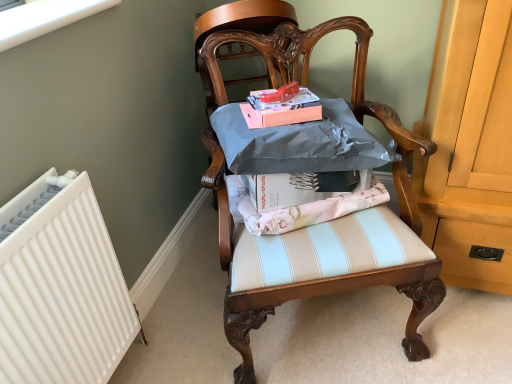
Identify the location of vacant space underneath wooden chair at center (from a real-world perspective). (322, 329).